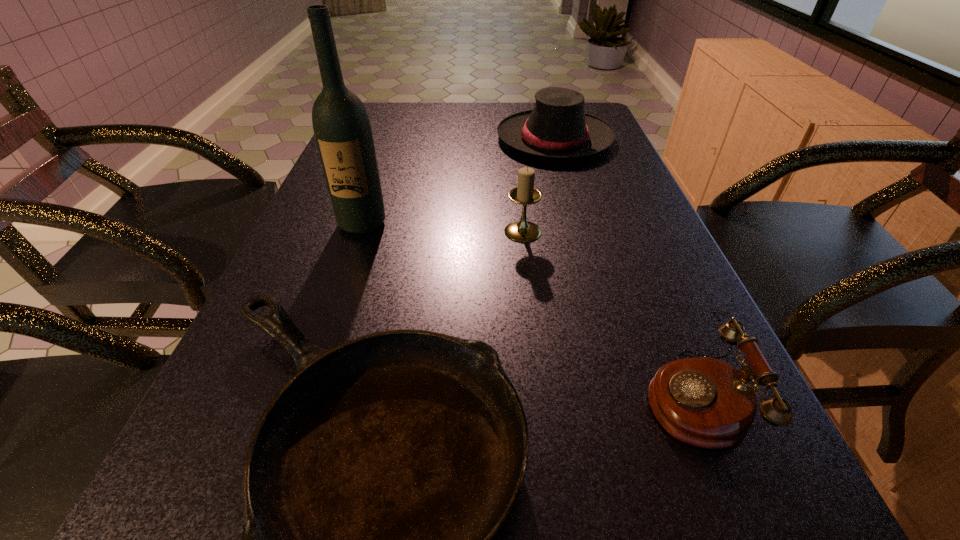
Identify the location of vacant space that's between the dress hat and the candle holder. (539, 185).

At what (x,y) coordinates should I click in order to perform the action: click on vacant space that is in between the dress hat and the telephone. Please return your answer as a coordinate pair (x, y). The height and width of the screenshot is (540, 960). Looking at the image, I should click on (623, 268).

Find the location of `empty space that is in between the candle holder and the tallest object`. empty space that is in between the candle holder and the tallest object is located at coordinates (443, 227).

Identify which object is located as the fourth nearest to the farthest object. Please provide its 2D coordinates. Your answer should be formatted as a tuple, i.e. [(x, y)], where the tuple contains the x and y coordinates of a point satisfying the conditions above.

[(702, 401)]

Identify which object is the nearest to the telephone. Please provide its 2D coordinates. Your answer should be formatted as a tuple, i.e. [(x, y)], where the tuple contains the x and y coordinates of a point satisfying the conditions above.

[(374, 481)]